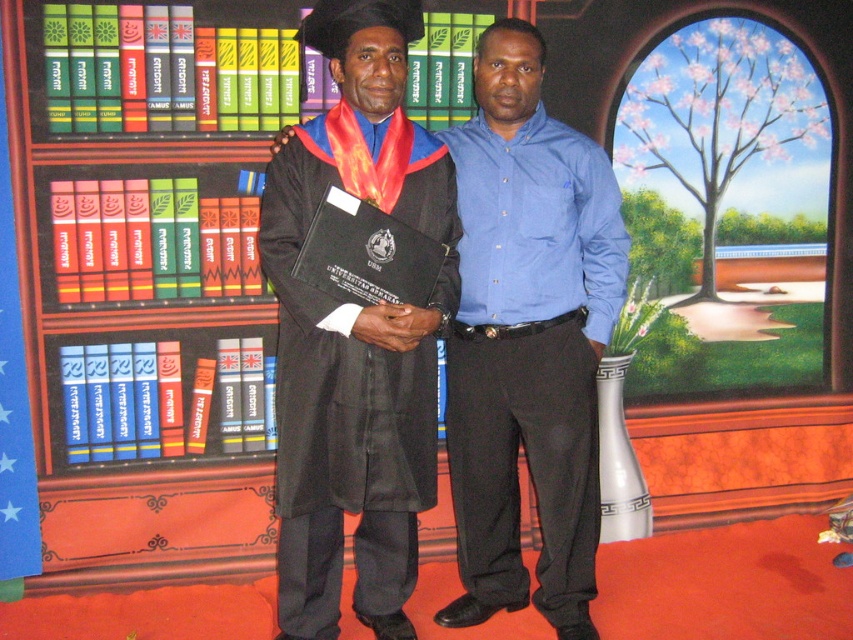
Question: Which point appears farthest from the camera in this image?

Choices:
 (A) (53, 268)
 (B) (357, 548)

Answer: (A)

Question: Which object is the farthest from the wooden bookcase at left?

Choices:
 (A) matte black robe at center
 (B) matte black graduation gown at center

Answer: (A)

Question: Does wooden bookcase at left appear under black matte graduation gown at center?

Choices:
 (A) yes
 (B) no

Answer: (B)

Question: Is matte black graduation gown at center closer to camera compared to black matte graduation gown at center?

Choices:
 (A) no
 (B) yes

Answer: (A)

Question: Can you confirm if matte black graduation gown at center is wider than black matte graduation gown at center?

Choices:
 (A) no
 (B) yes

Answer: (B)

Question: Which of these objects is positioned farthest from the matte black robe at center?

Choices:
 (A) black matte graduation gown at center
 (B) wooden bookcase at left

Answer: (B)